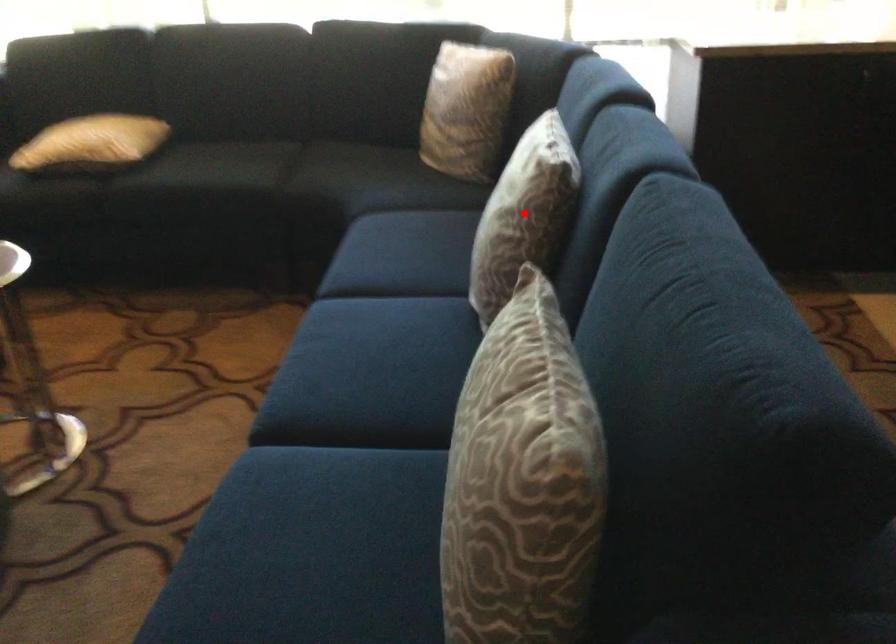
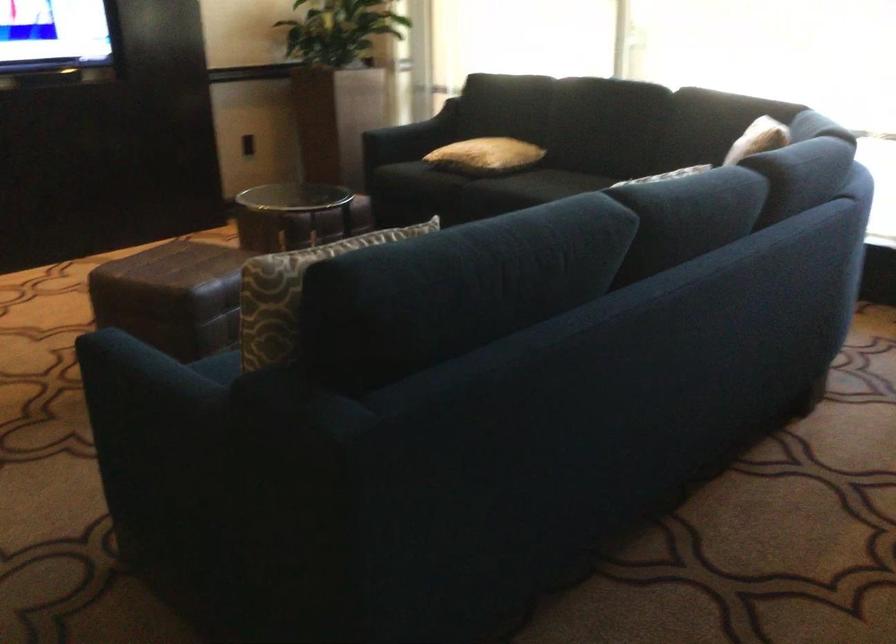
Question: I am providing you with two images of the same scene from different viewpoints. A red point is marked on the first image. Can you still see the location of the red point in image 2?

Choices:
 (A) Yes
 (B) No

Answer: (B)